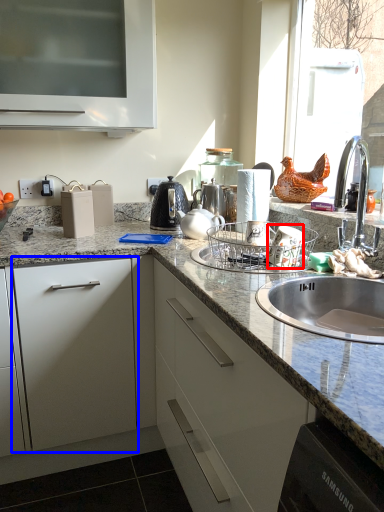
Question: Which object appears farthest to the camera in this image, appliance (highlighted by a red box) or drawer (highlighted by a blue box)?

Choices:
 (A) appliance
 (B) drawer

Answer: (B)